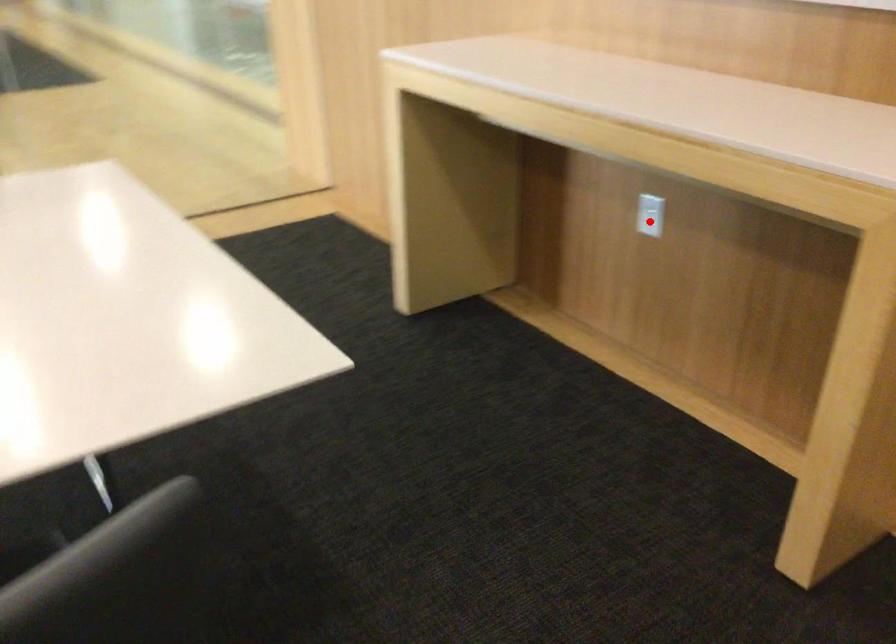
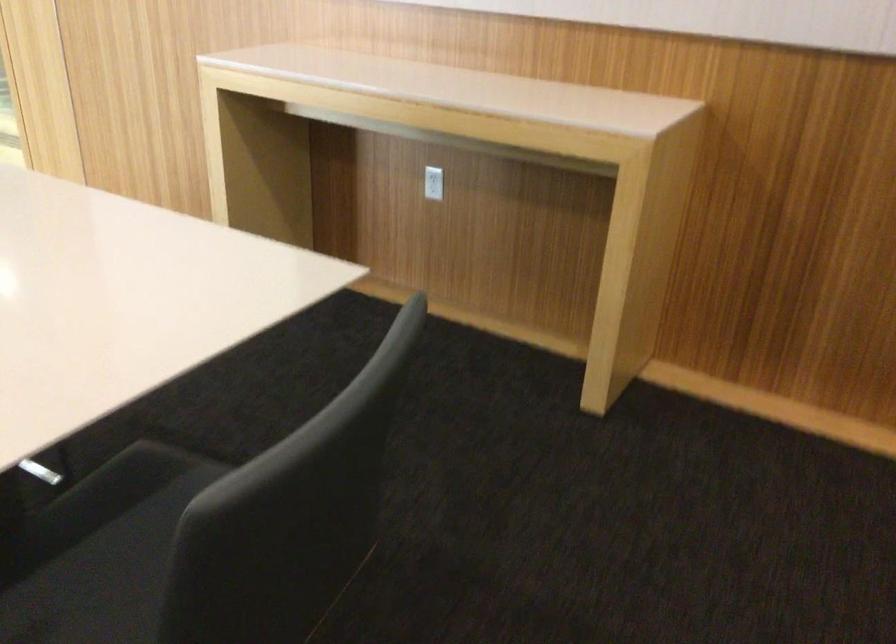
The point at the highlighted location is marked in the first image. Where is the corresponding point in the second image?

(433, 183)